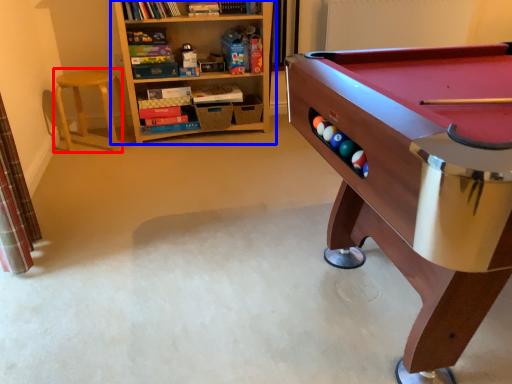
Question: Among these objects, which one is farthest to the camera, stool (highlighted by a red box) or bookcase (highlighted by a blue box)?

Choices:
 (A) stool
 (B) bookcase

Answer: (A)